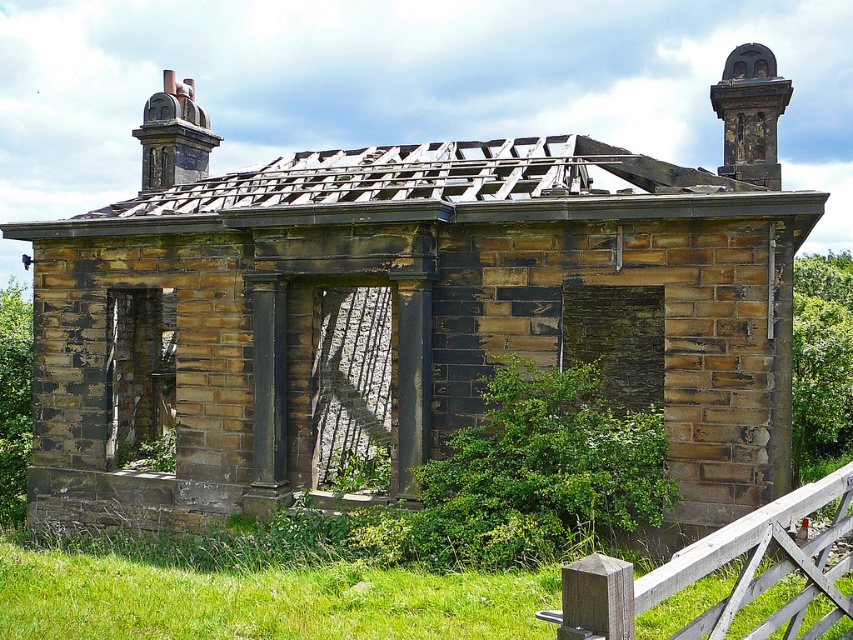
Does wooden fence at lower right appear on the left side of dark gray stone chimney at upper right?

Indeed, wooden fence at lower right is positioned on the left side of dark gray stone chimney at upper right.

Measure the distance between wooden fence at lower right and camera.

4.24 meters

I want to click on wooden fence at lower right, so [x=717, y=566].

Can you confirm if green leafy bush at center is bigger than dark gray stone chimney at upper right?

Incorrect, green leafy bush at center is not larger than dark gray stone chimney at upper right.

Which is more to the left, green leafy bush at center or dark gray stone chimney at upper right?

green leafy bush at center

Who is more distant from viewer, (500, 500) or (762, 138)?

The point (762, 138) is more distant.

Locate an element on the screen. The height and width of the screenshot is (640, 853). green leafy bush at center is located at coordinates (537, 476).

Between wooden fence at lower right and dark gray stone chimney at upper left, which one is positioned higher?

dark gray stone chimney at upper left is above.

Is wooden fence at lower right bigger than dark gray stone chimney at upper left?

Actually, wooden fence at lower right might be smaller than dark gray stone chimney at upper left.

What do you see at coordinates (717, 566) in the screenshot?
I see `wooden fence at lower right` at bounding box center [717, 566].

Identify the location of wooden fence at lower right. (717, 566).